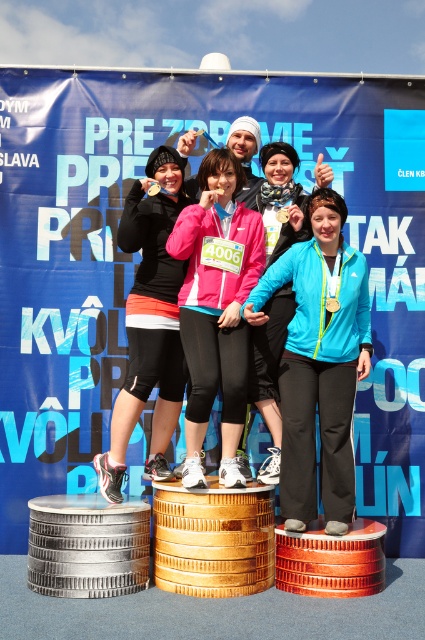
You are a photographer at the event and need to adjust your camera focus to capture both the pink fabric jacket at center and the matte black jacket at center clearly. Since the two jackets are at the same distance from the camera, which jacket will require a larger aperture setting to ensure both are in focus?

The pink fabric jacket at center is larger in size than the matte black jacket at center, so to ensure both are in focus, the photographer should use a smaller aperture setting to increase depth of field, not a larger aperture. A larger aperture would reduce depth of field, making it harder to keep both jackets in focus due to their size difference.

You are organizing a photo shoot and need to ensure that the matte black jacket at center and the matte pink jacket at center are visible in the final image. Given their sizes, which jacket should you focus on to ensure it doesn

The matte black jacket at center is bigger than the matte pink jacket at center, so focusing on the matte black jacket at center would ensure it is visible since it is larger and more prominent.

Based on the photo, you are an event photographer who needs to capture a clear shot of both the pink fabric jacket at center and the matte pink jacket at center. However, you notice that one is blocking the other. Which jacket is positioned in front and which is behind?

The pink fabric jacket at center is below the matte pink jacket at center, so the matte pink jacket at center is in front and the pink fabric jacket at center is behind.